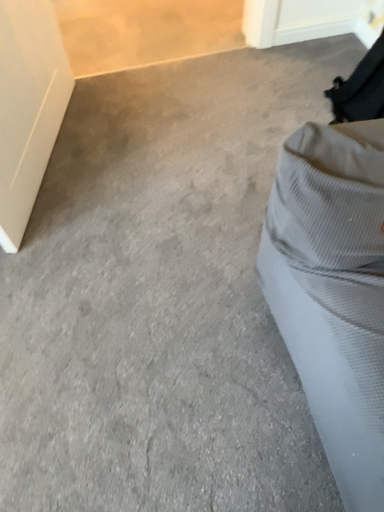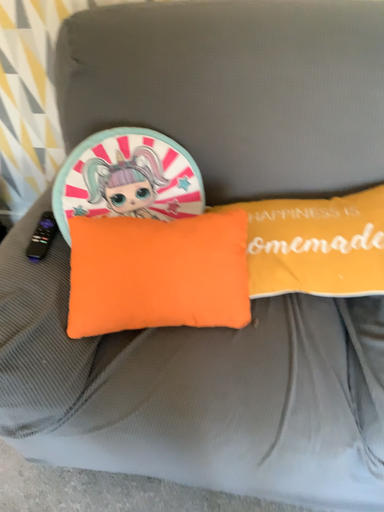
Question: How did the camera likely rotate when shooting the video?

Choices:
 (A) rotated downward
 (B) rotated upward

Answer: (B)